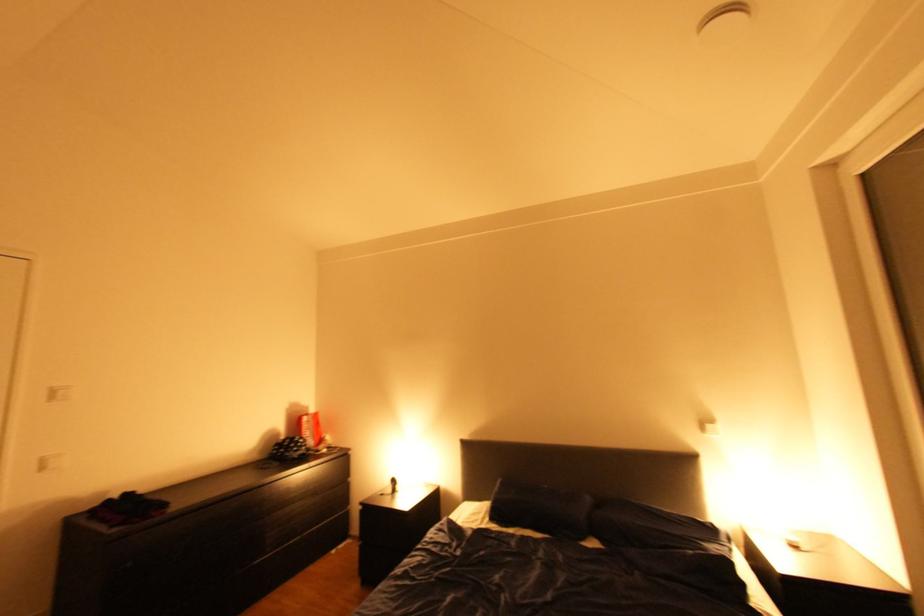
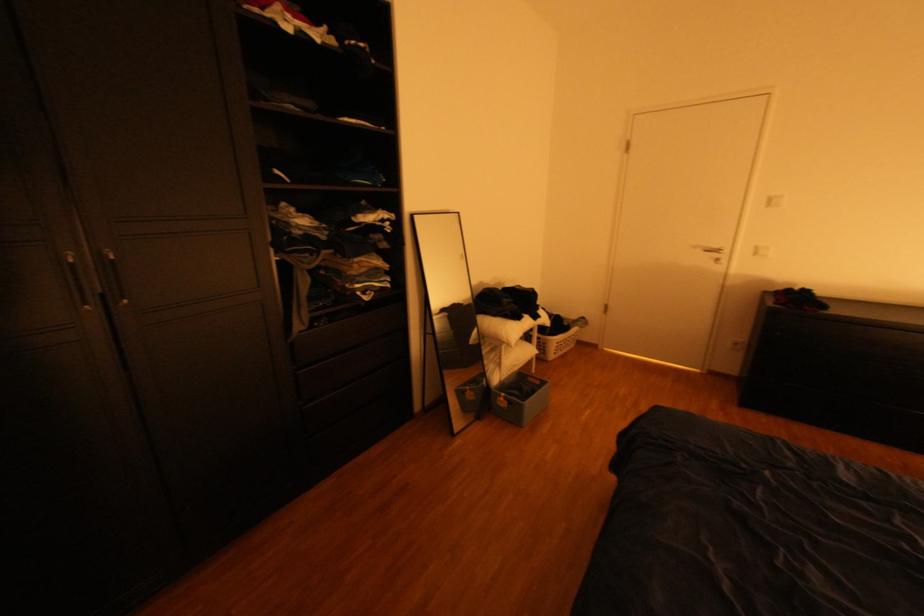
First-person continuous shooting, in which direction is the camera rotating?

The camera's rotation is toward left-down.